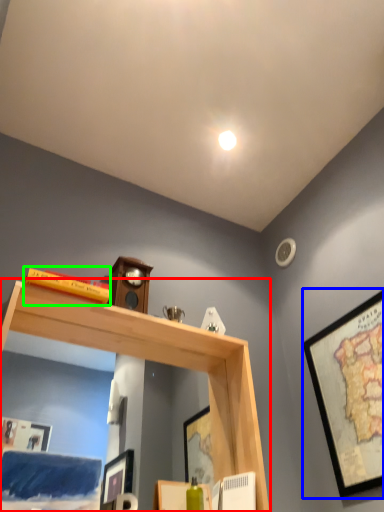
Question: Based on their relative distances, which object is farther from shelf (highlighted by a red box)? Choose from picture frame (highlighted by a blue box) and book (highlighted by a green box).

Choices:
 (A) picture frame
 (B) book

Answer: (A)